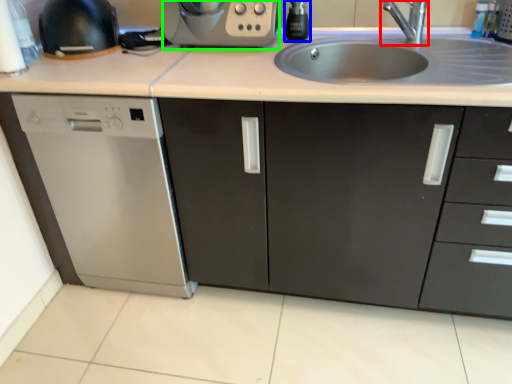
Question: Which object is positioned closest to tap (highlighted by a red box)? Select from appliance (highlighted by a blue box) and kitchen appliance (highlighted by a green box).

Choices:
 (A) appliance
 (B) kitchen appliance

Answer: (A)